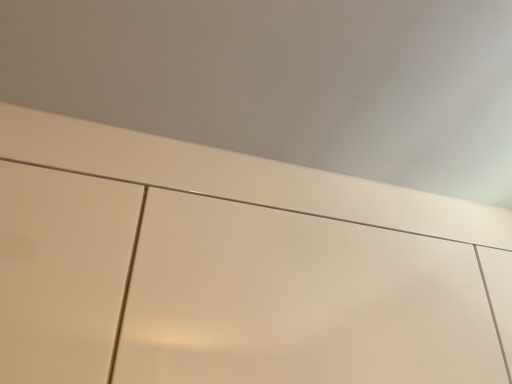
The height and width of the screenshot is (384, 512). In order to click on matte white cupboard at center in this screenshot , I will do `click(241, 177)`.

Describe the element at coordinates (241, 177) in the screenshot. I see `matte white cupboard at center` at that location.

The width and height of the screenshot is (512, 384). I want to click on matte white cupboard at center, so click(241, 177).